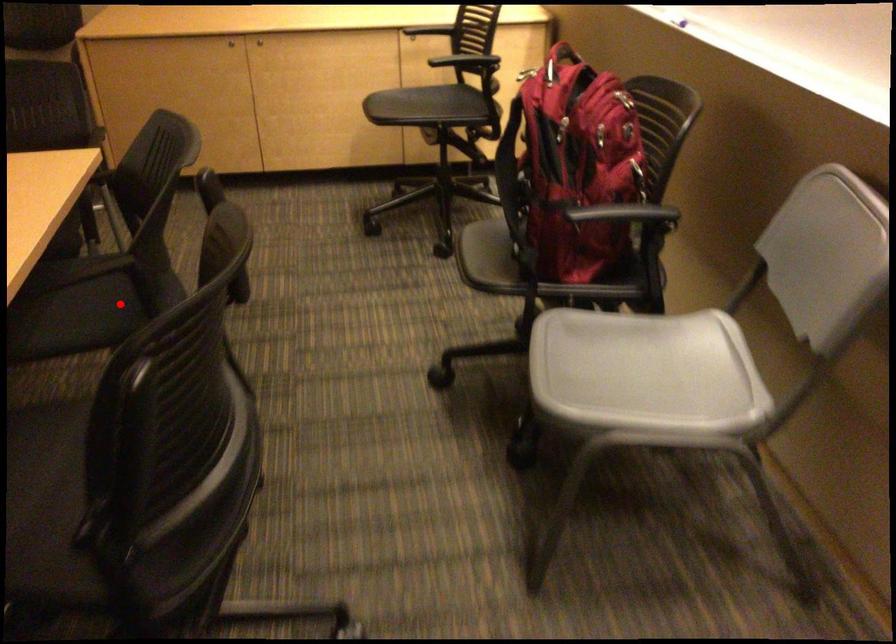
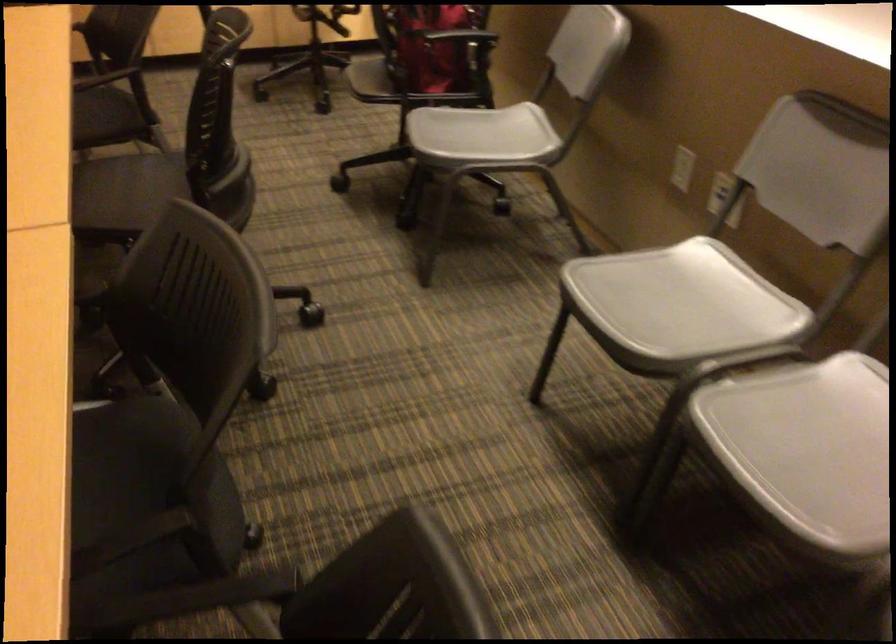
Question: I am providing you with two images of the same scene from different viewpoints. A red point is shown in image1. For the corresponding object point in image2, is it positioned nearer or farther from the camera?

Choices:
 (A) Nearer
 (B) Farther

Answer: (B)